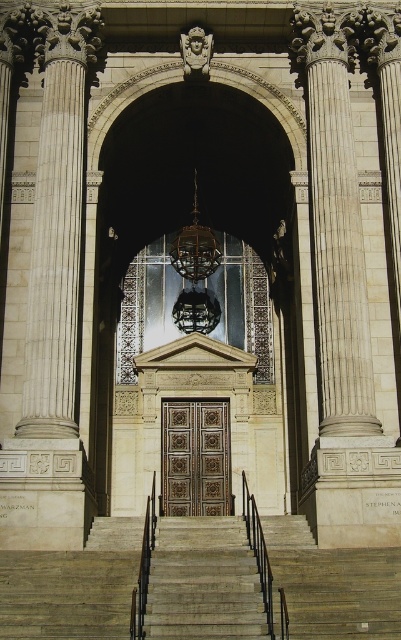
What are the coordinates of the gold ornate door at center?

The gold ornate door at center is located at coordinates point (194,458).

You are a person with a height of 1.7 meters standing at the bottom of the gray stone stairs at center. You want to reach the gold ornate door at center located above. Considering the size difference between the stairs and the door, can you estimate if you can comfortably reach the door by climbing the stairs?

The gray stone stairs at center are larger in size compared to the gold ornate door at center. However, stairs are designed to lead up to doors regardless of their relative sizes, so you can comfortably reach the gold ornate door at center by climbing the gray stone stairs at center.